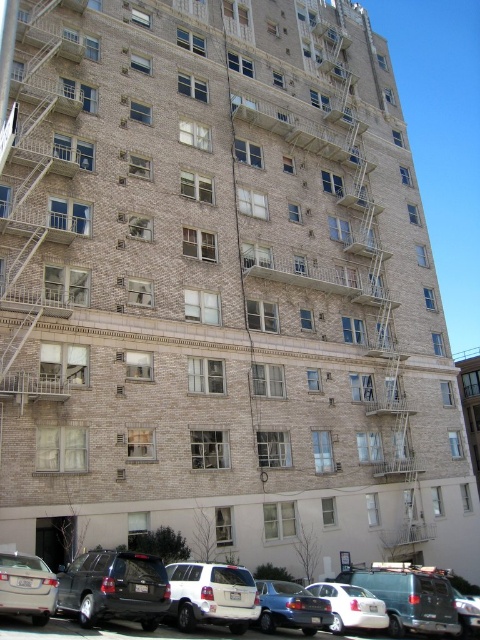
Is matte silver sedan at lower center below metallic silver car at center?

Incorrect, matte silver sedan at lower center is not positioned below metallic silver car at center.

Who is positioned more to the right, matte silver sedan at lower center or metallic silver car at center?

metallic silver car at center

At what (x,y) coordinates should I click in order to perform the action: click on matte silver sedan at lower center. Please return your answer as a coordinate pair (x, y). The height and width of the screenshot is (640, 480). Looking at the image, I should click on (290, 608).

Does matte black suv at lower left appear over metallic silver car at center?

Yes, matte black suv at lower left is above metallic silver car at center.

Which of these two, matte black suv at lower left or metallic silver car at center, stands taller?

metallic silver car at center is taller.

The width and height of the screenshot is (480, 640). Describe the element at coordinates (113, 588) in the screenshot. I see `matte black suv at lower left` at that location.

Where is `matte black suv at lower left`? This screenshot has height=640, width=480. matte black suv at lower left is located at coordinates (113, 588).

Who is shorter, white matte suv at center or matte silver sedan at lower center?

matte silver sedan at lower center is shorter.

Does white matte suv at center appear on the right side of matte silver sedan at lower center?

In fact, white matte suv at center is to the left of matte silver sedan at lower center.

This screenshot has height=640, width=480. What do you see at coordinates (212, 595) in the screenshot?
I see `white matte suv at center` at bounding box center [212, 595].

The image size is (480, 640). I want to click on white matte suv at center, so click(212, 595).